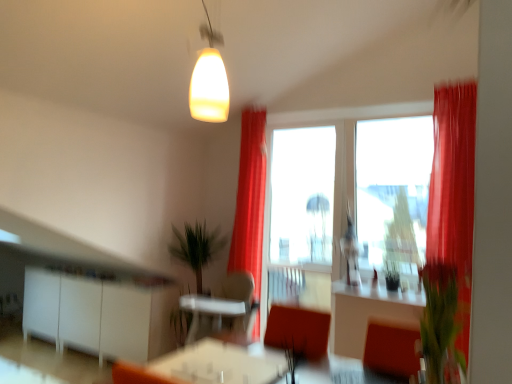
The image size is (512, 384). What do you see at coordinates (293, 357) in the screenshot? I see `green matte plant at center, the first plant positioned from the bottom` at bounding box center [293, 357].

The height and width of the screenshot is (384, 512). Describe the element at coordinates (250, 199) in the screenshot. I see `silky red curtain at center, the second curtain when ordered from front to back` at that location.

Image resolution: width=512 pixels, height=384 pixels. What are the coordinates of `green leafy plant at right, the second plant when ordered from bottom to top` in the screenshot? It's located at (440, 321).

The width and height of the screenshot is (512, 384). I want to click on white glossy counter top at center, so click(378, 293).

I want to click on transparent glass window at center, the 1th window screen positioned from the right, so click(393, 189).

The image size is (512, 384). What are the coordinates of `green matte plant at center, the first plant positioned from the bottom` in the screenshot? It's located at (293, 357).

From the image's perspective, starting from the matte orange table at center, which curtain is the 2nd one above? Please provide its 2D coordinates.

[(454, 190)]

Consider the image. Considering the relative sizes of matte orange table at center and silky red curtain at right, which appears as the second curtain when viewed from the back, in the image provided, is matte orange table at center shorter than silky red curtain at right, which appears as the second curtain when viewed from the back,?

Correct, matte orange table at center is not as tall as silky red curtain at right, which appears as the second curtain when viewed from the back.

In terms of width, does matte orange table at center look wider or thinner when compared to silky red curtain at right, which appears as the second curtain when viewed from the back?

Clearly, matte orange table at center has more width compared to silky red curtain at right, which appears as the second curtain when viewed from the back.

From the image's perspective, is green leafy plant at right, the 1th plant in the right-to-left sequence, above or below green leafy plant at center?

green leafy plant at right, the 1th plant in the right-to-left sequence, is situated higher than green leafy plant at center in the image.

Would you say green leafy plant at center is part of green leafy plant at right, which is the 2th plant in back-to-front order,'s contents?

No.

Who is bigger, green leafy plant at right, marked as the 1th plant in a front-to-back arrangement, or green leafy plant at center?

green leafy plant at center.

Does point (446, 305) appear closer or farther from the camera than point (191, 268)?

Point (446, 305) appears to be closer to the viewer than point (191, 268).

From the picture: Is green matte plant at center, the 2th plant in the front-to-back sequence, inside or outside of transparent glass window at center, marked as the 2th window screen in a left-to-right arrangement?

green matte plant at center, the 2th plant in the front-to-back sequence, exists outside the volume of transparent glass window at center, marked as the 2th window screen in a left-to-right arrangement.

Can you confirm if green matte plant at center, the first plant positioned from the back, is positioned to the left of transparent glass window at center, acting as the first window screen starting from the front?

Yes, green matte plant at center, the first plant positioned from the back, is to the left of transparent glass window at center, acting as the first window screen starting from the front.

From a real-world perspective, between green matte plant at center, the 2th plant in the front-to-back sequence, and transparent glass window at center, marked as the 2th window screen in a left-to-right arrangement, who is vertically lower?

green matte plant at center, the 2th plant in the front-to-back sequence.

Does green matte plant at center, the first plant positioned from the bottom, have a lesser width compared to transparent glass window at center, marked as the 2th window screen in a left-to-right arrangement?

Yes.

This screenshot has width=512, height=384. Find the location of `the 1st plant in front of the matte glass pendant at upper center`. the 1st plant in front of the matte glass pendant at upper center is located at coordinates (293, 357).

Is matte glass pendant at upper center in front of or behind green matte plant at center, the first plant positioned from the back, in the image?

Clearly, matte glass pendant at upper center is behind green matte plant at center, the first plant positioned from the back.

From a real-world perspective, is matte glass pendant at upper center below green matte plant at center, the first plant positioned from the back?

No, from a real-world perspective, matte glass pendant at upper center is not under green matte plant at center, the first plant positioned from the back.

From the image's perspective, is matte glass pendant at upper center located above or below green matte plant at center, the 2th plant viewed from the top?

From the image's perspective, matte glass pendant at upper center appears above green matte plant at center, the 2th plant viewed from the top.

From the image's perspective, between transparent glass window at center, marked as the 2th window screen in a left-to-right arrangement, and green matte plant at center, the 2th plant in the front-to-back sequence, who is located below?

green matte plant at center, the 2th plant in the front-to-back sequence, from the image's perspective.

Is transparent glass window at center, acting as the first window screen starting from the front, bigger or smaller than green matte plant at center, marked as the 1th plant in a left-to-right arrangement?

Considering their sizes, transparent glass window at center, acting as the first window screen starting from the front, takes up more space than green matte plant at center, marked as the 1th plant in a left-to-right arrangement.

In the scene shown: Is transparent glass window at center, the 1th window screen positioned from the right, inside the boundaries of green matte plant at center, which is the second plant in right-to-left order, or outside?

transparent glass window at center, the 1th window screen positioned from the right, lies outside green matte plant at center, which is the second plant in right-to-left order.

In the scene shown: From a real-world perspective, is transparent glass window at center, the 1th window screen positioned from the right, physically located above or below green matte plant at center, marked as the 1th plant in a left-to-right arrangement?

transparent glass window at center, the 1th window screen positioned from the right, is situated higher than green matte plant at center, marked as the 1th plant in a left-to-right arrangement, in the real world.

From the image's perspective, between green leafy plant at center and silky red curtain at right, the first curtain positioned from the right, who is located below?

green leafy plant at center is shown below in the image.

Is green leafy plant at center beside silky red curtain at right, the first curtain positioned from the right?

No, green leafy plant at center is not with silky red curtain at right, the first curtain positioned from the right.

Image resolution: width=512 pixels, height=384 pixels. I want to click on the 2nd curtain directly above the green leafy plant at center (from a real-world perspective), so click(x=454, y=190).

Considering the sizes of objects green leafy plant at center and silky red curtain at right, which ranks as the second curtain in left-to-right order, in the image provided, who is wider, green leafy plant at center or silky red curtain at right, which ranks as the second curtain in left-to-right order,?

green leafy plant at center is wider.

Would you say transparent glass window at center, which appears as the 1th window screen when viewed from the back, is part of matte glass pendant at upper center's contents?

No, transparent glass window at center, which appears as the 1th window screen when viewed from the back, is not a part of matte glass pendant at upper center.

What are the coordinates of `light fixture above the transparent glass window at center, the second window screen viewed from the right (from the image's perspective)` in the screenshot? It's located at (209, 79).

Which of these two, matte glass pendant at upper center or transparent glass window at center, marked as the first window screen in a left-to-right arrangement, is thinner?

With smaller width is transparent glass window at center, marked as the first window screen in a left-to-right arrangement.

From the image's perspective, which object appears higher, matte glass pendant at upper center or transparent glass window at center, the second window screen viewed from the right?

matte glass pendant at upper center, from the image's perspective.

At what (x,y) coordinates should I click in order to perform the action: click on table in front of the silky red curtain at right, the first curtain positioned from the right. Please return your answer as a coordinate pair (x, y). The image size is (512, 384). Looking at the image, I should click on (222, 364).

Where is `houseplant below the green leafy plant at right, marked as the 1th plant in a front-to-back arrangement (from a real-world perspective)`? The height and width of the screenshot is (384, 512). houseplant below the green leafy plant at right, marked as the 1th plant in a front-to-back arrangement (from a real-world perspective) is located at coordinates (197, 250).

Considering their positions, is transparent glass window at center, acting as the first window screen starting from the front, positioned closer to green leafy plant at center than matte orange table at center?

matte orange table at center is positioned closer to the anchor green leafy plant at center.

From the image, which object appears to be farther from silky red curtain at center, the second curtain when ordered from front to back, silky red curtain at right, the first curtain positioned from the right, or green matte plant at center, which is the second plant in right-to-left order?

silky red curtain at right, the first curtain positioned from the right, lies further to silky red curtain at center, the second curtain when ordered from front to back, than the other object.

Based on the photo, estimate the real-world distances between objects in this image. Which object is further from matte glass pendant at upper center, green matte plant at center, the 2th plant in the front-to-back sequence, or silky red curtain at center, the second curtain when ordered from front to back?

Based on the image, silky red curtain at center, the second curtain when ordered from front to back, appears to be further to matte glass pendant at upper center.

Considering their positions, is white glossy counter top at center positioned further to green matte plant at center, marked as the 1th plant in a left-to-right arrangement, than green leafy plant at center?

Among the two, green leafy plant at center is located further to green matte plant at center, marked as the 1th plant in a left-to-right arrangement.

Looking at the image, which one is located closer to transparent glass window at center, marked as the first window screen in a left-to-right arrangement, green leafy plant at center or white glossy counter top at center?

green leafy plant at center is closer to transparent glass window at center, marked as the first window screen in a left-to-right arrangement.

Estimate the real-world distances between objects in this image. Which object is further from matte orange table at center, transparent glass window at center, the 1th window screen positioned from the right, or white glossy counter top at center?

transparent glass window at center, the 1th window screen positioned from the right, is further to matte orange table at center.

Which object lies nearer to the anchor point green leafy plant at center, transparent glass window at center, marked as the first window screen in a left-to-right arrangement, or green matte plant at center, marked as the 1th plant in a left-to-right arrangement?

The object closer to green leafy plant at center is green matte plant at center, marked as the 1th plant in a left-to-right arrangement.

Looking at the image, which one is located closer to transparent glass window at center, which is counted as the second window screen, starting from the back, matte glass pendant at upper center or green leafy plant at right, marked as the 1th plant in a front-to-back arrangement?

matte glass pendant at upper center.

What are the coordinates of `counter top between matte orange table at center and silky red curtain at center, the second curtain when ordered from front to back, from front to back` in the screenshot? It's located at point(378,293).

The image size is (512, 384). What are the coordinates of `window screen between matte glass pendant at upper center and silky red curtain at center, the 2th curtain in the right-to-left sequence, in the front-back direction` in the screenshot? It's located at (393, 189).

The width and height of the screenshot is (512, 384). Identify the location of curtain between green leafy plant at right, which appears as the second plant when viewed from the left, and transparent glass window at center, which is counted as the second window screen, starting from the back, along the z-axis. (454, 190).

Find the location of `light fixture located between green leafy plant at right, which is the 1th plant from top to bottom, and silky red curtain at center, the 2th curtain in the right-to-left sequence, in the depth direction`. light fixture located between green leafy plant at right, which is the 1th plant from top to bottom, and silky red curtain at center, the 2th curtain in the right-to-left sequence, in the depth direction is located at coordinates (209, 79).